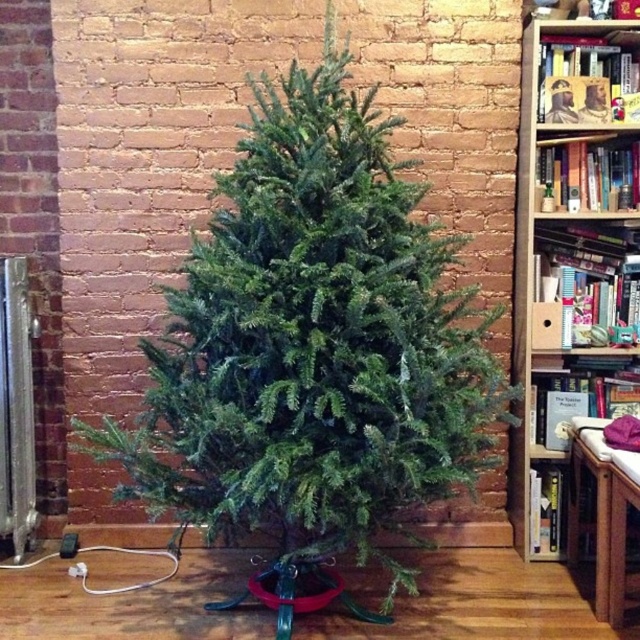
You are standing in the room and want to take a photo of the green matte christmas tree at center without the wooden bookshelf at right appearing in the background. Is it possible to do so based on their positions?

Yes, because the green matte christmas tree at center is in front of the wooden bookshelf at right, you can position yourself so that the tree blocks the view of the bookshelf, making it possible to take a photo without the bookshelf appearing in the background.

You are planning to hang an ornament on the green matte christmas tree at center. Considering the position of the wooden bookshelf at right, will you need to move the bookshelf to access the top of the tree?

The green matte christmas tree at center is located below the wooden bookshelf at right, meaning the bookshelf is above the tree. Since the bookshelf is above, you won not need to move it to access the top of the tree.

You are planning to move the green matte christmas tree at center and the wooden bookshelf at right to a new room. The doorway you need to pass through is 1.5 meters wide. Can both items fit through the doorway side by side without rotating them?

The green matte christmas tree at center is wider than the wooden bookshelf at right. Since the doorway is 1.5 meters wide, but the combined width of both items would exceed this measurement, they cannot fit through the doorway side by side without rotating them.